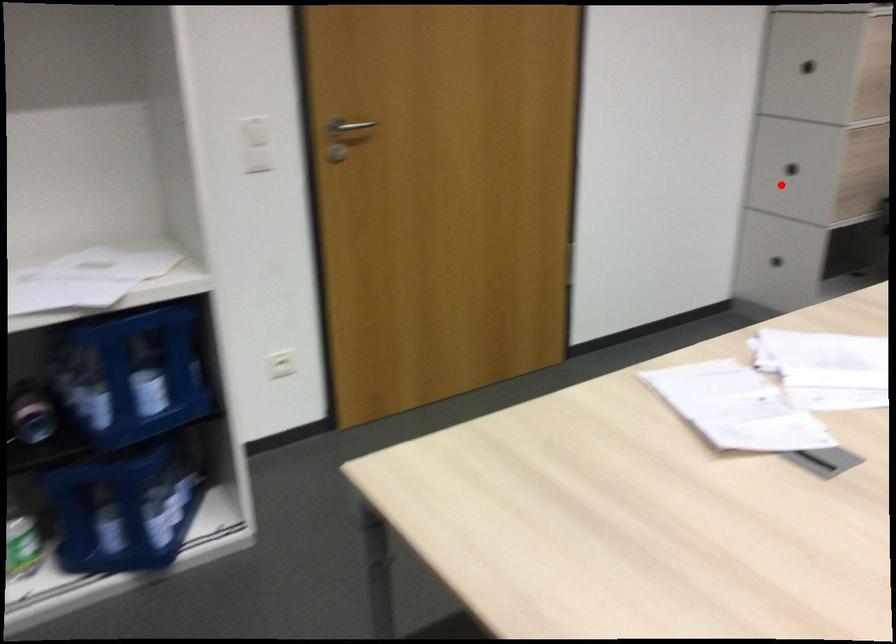
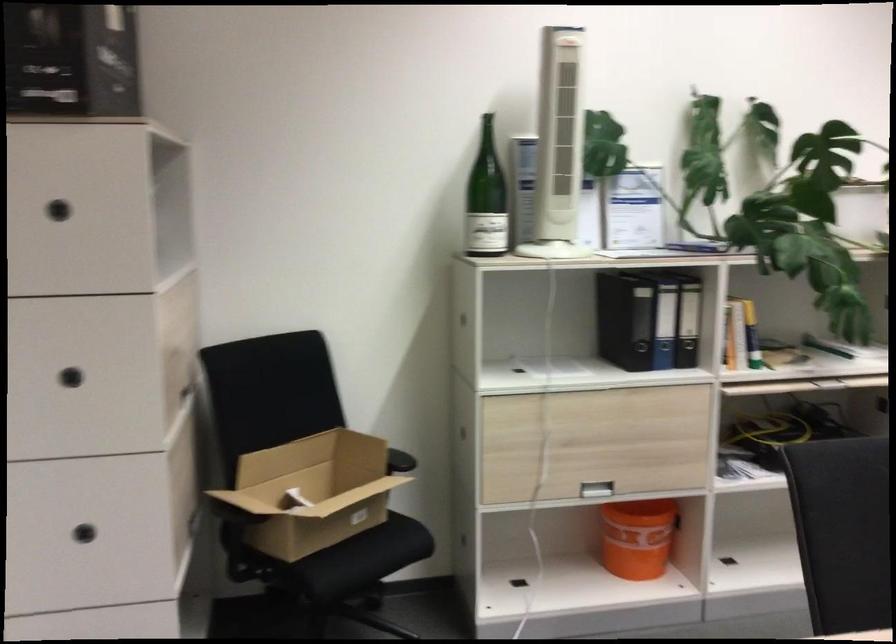
Question: I am providing you with two images of the same scene from different viewpoints. Image1 has a red point marked. In image2, the corresponding 3D location appears at what relative position? Reply with the corresponding letter.

Choices:
 (A) Closer
 (B) Farther

Answer: (A)